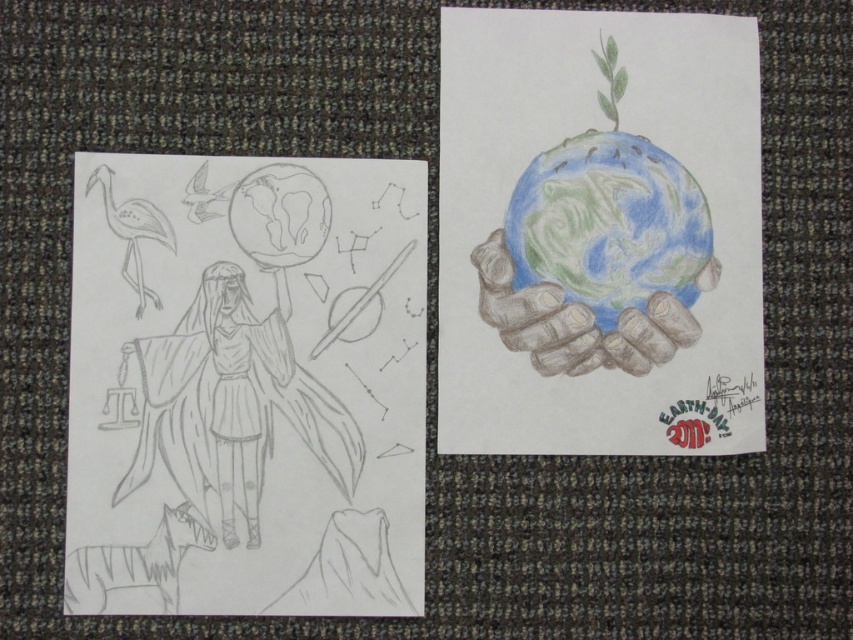
You are an art curator examining the two pieces of artwork displayed on the carpet. You notice two specific points marked in the image. The first point is at coordinates point(666,253) and the second at point(494,273). From your vantage point, which of these two points appears closer to you?

Point(666,253) is further to the viewer than point(494,273), so the first point appears closer to you.

You are an art curator planning to display the pastel colored globe at center and the colored pencil hands at center together. Based on their sizes, which one should be placed in a more prominent position to highlight its visual impact?

The pastel colored globe at center is larger in size than the colored pencil hands at center, so it should be placed in a more prominent position to highlight its visual impact.

You are an art curator arranging an exhibition. You need to place a new sculpture exactly halfway between the pencil sketch of figure holding globe at center and another artwork on the right. Given the coordinates from the image, can you determine the midpoint coordinates for placing the sculpture?

The midpoint coordinates between the pencil sketch of figure holding globe at center located at point (247, 385) and the other artwork on the right would be calculated by averaging their coordinates. However, since the coordinates for the other artwork on the right are not provided in the Objects Description, I cannot determine the exact midpoint. Please provide the coordinates of the second artwork to proceed.